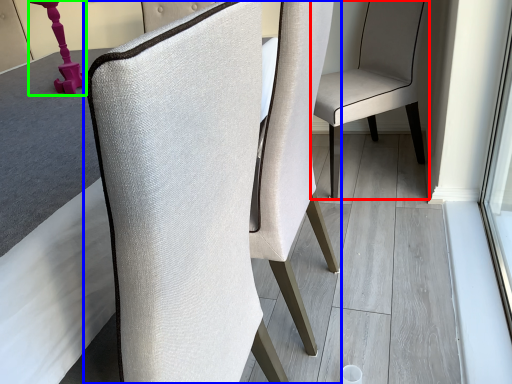
Question: Estimate the real-world distances between objects in this image. Which object is farther from chair (highlighted by a red box), chair (highlighted by a blue box) or table lamp (highlighted by a green box)?

Choices:
 (A) chair
 (B) table lamp

Answer: (B)